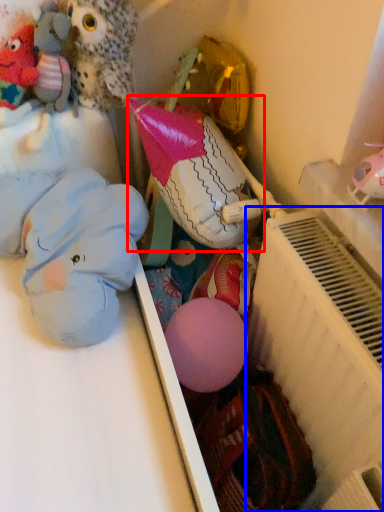
Question: Among these objects, which one is farthest to the camera, toy (highlighted by a red box) or radiator (highlighted by a blue box)?

Choices:
 (A) toy
 (B) radiator

Answer: (A)